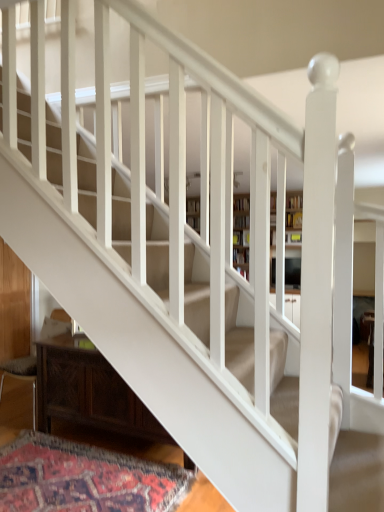
Question: Considering the relative positions of dark wood cabinet at lower left and carpeted mat at lower left in the image provided, is dark wood cabinet at lower left behind carpeted mat at lower left?

Choices:
 (A) yes
 (B) no

Answer: (A)

Question: Is dark wood cabinet at lower left directly adjacent to carpeted mat at lower left?

Choices:
 (A) yes
 (B) no

Answer: (B)

Question: From the image's perspective, does dark wood cabinet at lower left appear higher than carpeted mat at lower left?

Choices:
 (A) yes
 (B) no

Answer: (A)

Question: Is dark wood cabinet at lower left outside of carpeted mat at lower left?

Choices:
 (A) no
 (B) yes

Answer: (B)

Question: Is dark wood cabinet at lower left taller than carpeted mat at lower left?

Choices:
 (A) yes
 (B) no

Answer: (A)

Question: Is dark wood cabinet at lower left facing away from carpeted mat at lower left?

Choices:
 (A) yes
 (B) no

Answer: (B)

Question: Can you confirm if wooden armchair at lower left is positioned to the left of dark wood cabinet at lower left?

Choices:
 (A) no
 (B) yes

Answer: (B)

Question: From a real-world perspective, is wooden armchair at lower left on dark wood cabinet at lower left?

Choices:
 (A) no
 (B) yes

Answer: (B)

Question: Is dark wood cabinet at lower left at the back of wooden armchair at lower left?

Choices:
 (A) yes
 (B) no

Answer: (B)

Question: Is wooden armchair at lower left aimed at dark wood cabinet at lower left?

Choices:
 (A) no
 (B) yes

Answer: (A)

Question: From a real-world perspective, does wooden armchair at lower left sit lower than dark wood cabinet at lower left?

Choices:
 (A) yes
 (B) no

Answer: (B)

Question: Can we say wooden armchair at lower left lies outside dark wood cabinet at lower left?

Choices:
 (A) yes
 (B) no

Answer: (A)

Question: From a real-world perspective, is wooden armchair at lower left below carpeted mat at lower left?

Choices:
 (A) yes
 (B) no

Answer: (B)